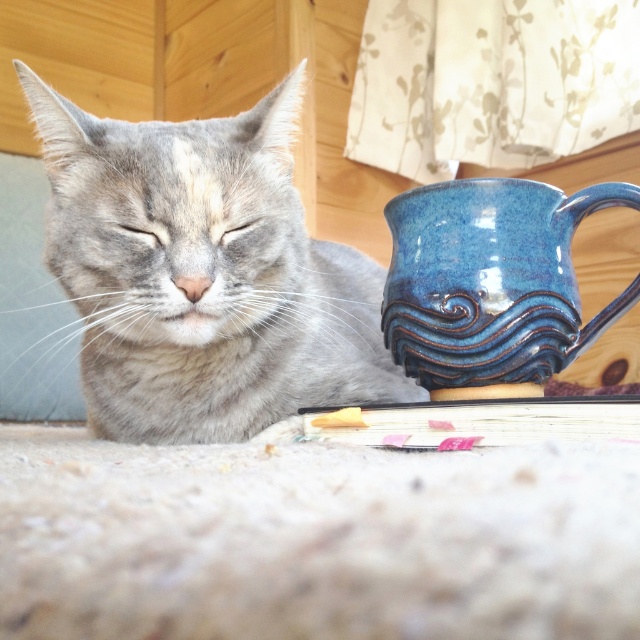
Looking at this image, you are taking a photo of the gray tabby cat and need to focus on two specific points in the image. The first point is at coordinates point (492, 346) and the second is at point (148, 230). Which point should you focus on first if you want to ensure the cat is in sharp focus?

You should focus on point (492, 346) first because it is closer to the camera than point (148, 230), ensuring the cat is in sharp focus.

You are a visitor in this room and want to place a small plant between the gray soft fur cat at left and the blue glazed mug at right. Based on their positions, which side of the cat should you place it to ensure it is between them?

The gray soft fur cat at left is to the left of the blue glazed mug at right, so placing the plant to the right of the gray soft fur cat at left will position it between them.

You are a cat owner who wants to place a new toy between the blue glazed mug at right and the gray fur eye at upper left. Which object should you move to create space?

The blue glazed mug at right is taller than the gray fur eye at upper left, so you should move the blue glazed mug at right to create space between them.